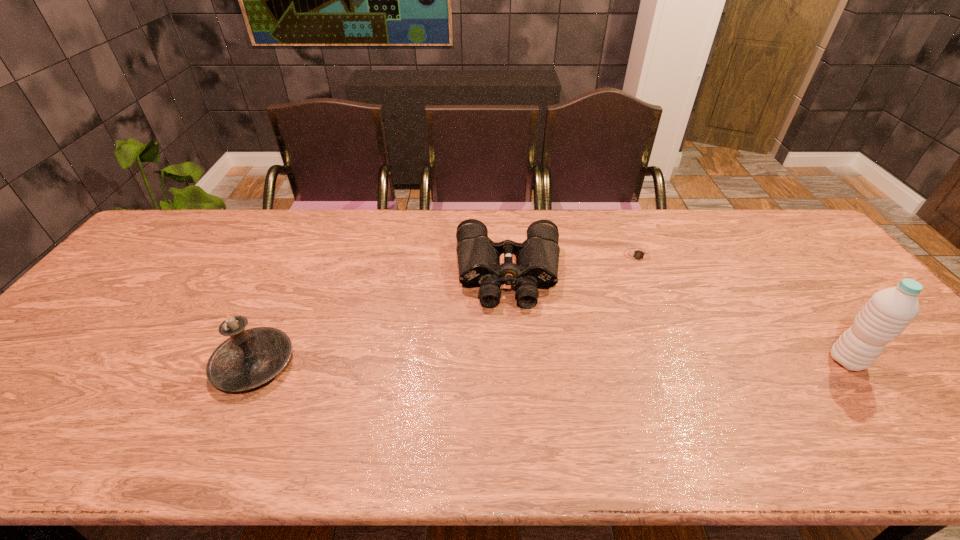
Where is `the leftmost object`? the leftmost object is located at coordinates (249, 358).

The image size is (960, 540). What are the coordinates of `the third shortest object` in the screenshot? It's located at (249, 358).

This screenshot has height=540, width=960. Identify the location of the rightmost object. (888, 312).

I want to click on the tallest object, so coord(888,312).

Where is `the third tallest object`? the third tallest object is located at coordinates (537, 258).

This screenshot has width=960, height=540. I want to click on binoculars, so click(x=537, y=258).

You are a GUI agent. You are given a task and a screenshot of the screen. Output one action in this format:
    pyautogui.click(x=<x>, y=<y>)
    Task: Click on the shortest object
    The width and height of the screenshot is (960, 540).
    Given the screenshot: What is the action you would take?
    pyautogui.click(x=637, y=254)

The image size is (960, 540). I want to click on watch, so click(637, 254).

Identify the location of vacant space located on the back of the third shortest object. (282, 303).

Image resolution: width=960 pixels, height=540 pixels. In order to click on free space located on the back of the rightmost object in this screenshot , I will do (786, 280).